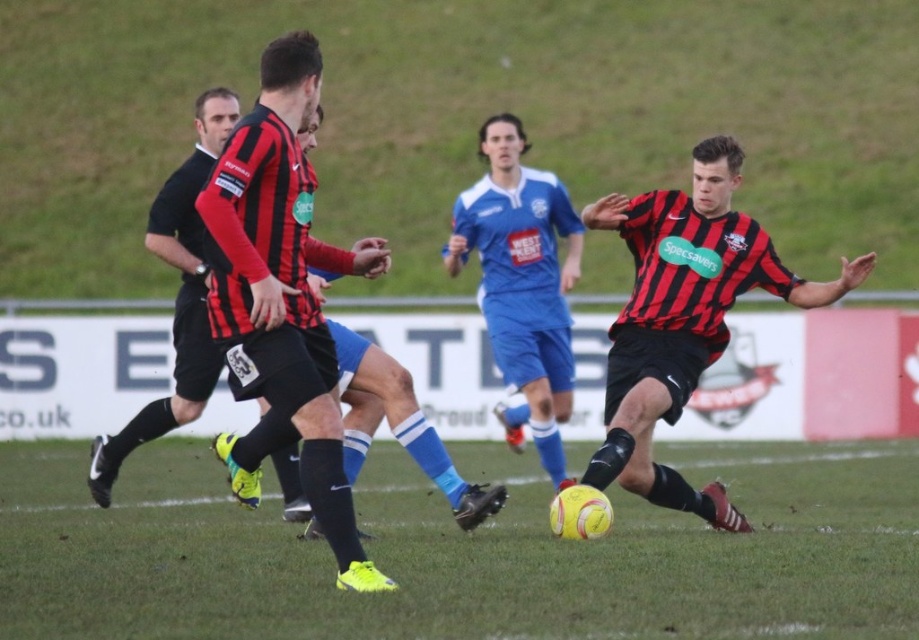
Which is more to the left, yellow rubber ball at center or matte black jersey at center?

Positioned to the left is yellow rubber ball at center.

What do you see at coordinates (464, 552) in the screenshot? I see `yellow rubber ball at center` at bounding box center [464, 552].

Who is more distant from viewer, (623, 588) or (705, 362)?

Positioned behind is point (705, 362).

You are a GUI agent. You are given a task and a screenshot of the screen. Output one action in this format:
    pyautogui.click(x=<x>, y=<y>)
    Task: Click on the yellow rubber ball at center
    
    Given the screenshot: What is the action you would take?
    click(x=464, y=552)